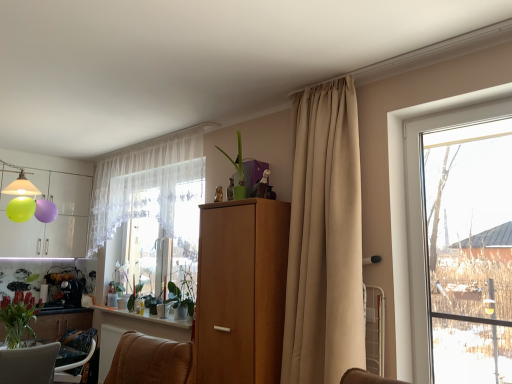
Question: Would you say green matte vase at lower left is a long distance from brown leather armchair at lower center, the first furniture in the back-to-front sequence?

Choices:
 (A) yes
 (B) no

Answer: (B)

Question: Is green matte vase at lower left bigger than brown leather armchair at lower center, the first furniture in the back-to-front sequence?

Choices:
 (A) yes
 (B) no

Answer: (B)

Question: From a real-world perspective, is green matte vase at lower left under brown leather armchair at lower center, the 2th furniture positioned from the front?

Choices:
 (A) yes
 (B) no

Answer: (B)

Question: Would you say brown leather armchair at lower center, the 2th furniture positioned from the front, is part of green matte vase at lower left's contents?

Choices:
 (A) yes
 (B) no

Answer: (B)

Question: Does green matte vase at lower left have a greater height compared to brown leather armchair at lower center, the first furniture in the back-to-front sequence?

Choices:
 (A) yes
 (B) no

Answer: (B)

Question: Considering the positions of transparent glass window at right and beige fabric curtain at center, marked as the 1th curtain in a right-to-left arrangement, in the image, is transparent glass window at right wider or thinner than beige fabric curtain at center, marked as the 1th curtain in a right-to-left arrangement,?

Choices:
 (A) thin
 (B) wide

Answer: (A)

Question: Is transparent glass window at right in front of or behind beige fabric curtain at center, which appears as the second curtain when viewed from the left, in the image?

Choices:
 (A) behind
 (B) front

Answer: (B)

Question: Considering the positions of transparent glass window at right and beige fabric curtain at center, placed as the 2th curtain when sorted from back to front, in the image, is transparent glass window at right taller or shorter than beige fabric curtain at center, placed as the 2th curtain when sorted from back to front,?

Choices:
 (A) short
 (B) tall

Answer: (A)

Question: Is transparent glass window at right situated inside beige fabric curtain at center, which appears as the second curtain when viewed from the left, or outside?

Choices:
 (A) inside
 (B) outside

Answer: (B)

Question: Considering their positions, is white glossy window sill at lower center located in front of or behind brown leather armchair at lower center, the first furniture in the back-to-front sequence?

Choices:
 (A) behind
 (B) front

Answer: (B)

Question: In terms of height, does white glossy window sill at lower center look taller or shorter compared to brown leather armchair at lower center, the first furniture in the back-to-front sequence?

Choices:
 (A) tall
 (B) short

Answer: (B)

Question: Choose the correct answer: Is white glossy window sill at lower center inside brown leather armchair at lower center, the 2th furniture positioned from the front, or outside it?

Choices:
 (A) outside
 (B) inside

Answer: (A)

Question: Is white glossy window sill at lower center wider or thinner than brown leather armchair at lower center, the first furniture in the back-to-front sequence?

Choices:
 (A) wide
 (B) thin

Answer: (A)

Question: Is green matte vase at lower left taller or shorter than transparent glass window at right?

Choices:
 (A) short
 (B) tall

Answer: (A)

Question: Is point (33, 307) positioned closer to the camera than point (423, 248)?

Choices:
 (A) farther
 (B) closer

Answer: (A)